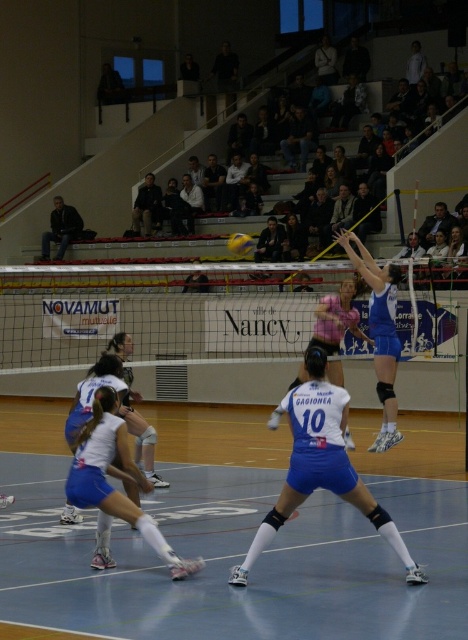
Question: Is black mesh net at center further to camera compared to yellow matte/vinyl volleyball at center?

Choices:
 (A) no
 (B) yes

Answer: (A)

Question: In this image, where is white matte shorts at center located relative to yellow matte/vinyl volleyball at center?

Choices:
 (A) below
 (B) above

Answer: (A)

Question: Does black mesh net at center appear on the left side of white matte volleyball at center?

Choices:
 (A) yes
 (B) no

Answer: (A)

Question: Which point is farther from the camera taking this photo?

Choices:
 (A) (382, 282)
 (B) (119, 340)
 (C) (99, 378)

Answer: (A)

Question: Considering the real-world distances, which object is farthest from the white matte shorts at center?

Choices:
 (A) white matte shorts at lower left
 (B) yellow matte/vinyl volleyball at center
 (C) white matte volleyball at center
 (D) pink fabric volleyball at center

Answer: (B)

Question: Which of the following is the closest to the observer?

Choices:
 (A) black mesh net at center
 (B) yellow matte/vinyl volleyball at center

Answer: (A)